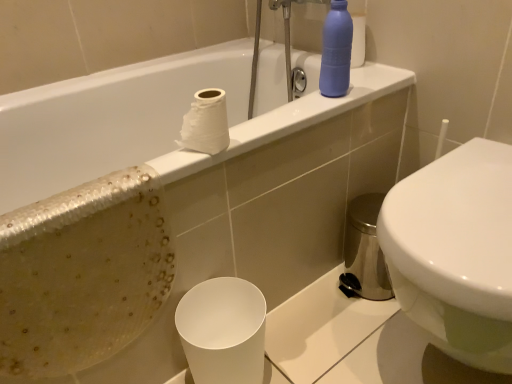
Locate an element on the screen. white glossy bathtub at upper center is located at coordinates (212, 172).

Identify the location of matte blue bottle at upper right. This screenshot has width=512, height=384. (336, 51).

What do you see at coordinates (206, 123) in the screenshot? Image resolution: width=512 pixels, height=384 pixels. I see `white matte toilet paper at upper center` at bounding box center [206, 123].

At what (x,y) coordinates should I click in order to perform the action: click on white glossy bathtub at upper center. Please return your answer as a coordinate pair (x, y). The height and width of the screenshot is (384, 512). Looking at the image, I should click on (212, 172).

Considering the relative positions of white matte paper cup at lower center and matte blue bottle at upper right in the image provided, is white matte paper cup at lower center to the left of matte blue bottle at upper right from the viewer's perspective?

Indeed, white matte paper cup at lower center is positioned on the left side of matte blue bottle at upper right.

This screenshot has width=512, height=384. I want to click on paper cup located underneath the matte blue bottle at upper right (from a real-world perspective), so click(223, 331).

Would you say white matte paper cup at lower center is inside or outside matte blue bottle at upper right?

white matte paper cup at lower center is outside matte blue bottle at upper right.

Considering the sizes of objects white matte paper cup at lower center and matte blue bottle at upper right in the image provided, who is wider, white matte paper cup at lower center or matte blue bottle at upper right?

white matte paper cup at lower center is wider.

Considering the sizes of objects white matte paper cup at lower center and white matte toilet paper at upper center in the image provided, who is wider, white matte paper cup at lower center or white matte toilet paper at upper center?

Wider between the two is white matte paper cup at lower center.

Is white matte paper cup at lower center positioned with its back to white matte toilet paper at upper center?

white matte paper cup at lower center is not turned away from white matte toilet paper at upper center.

Which is more to the right, white matte paper cup at lower center or white matte toilet paper at upper center?

From the viewer's perspective, white matte paper cup at lower center appears more on the right side.

Does white glossy bathtub at upper center have a lesser width compared to matte blue bottle at upper right?

No, white glossy bathtub at upper center is not thinner than matte blue bottle at upper right.

From the image's perspective, is white glossy bathtub at upper center on matte blue bottle at upper right?

No, from the image's perspective, white glossy bathtub at upper center is not over matte blue bottle at upper right.

How much distance is there between white glossy bathtub at upper center and matte blue bottle at upper right?

white glossy bathtub at upper center and matte blue bottle at upper right are 15.93 inches apart from each other.

Which object is positioned more to the left, white glossy bathtub at upper center or matte blue bottle at upper right?

white glossy bathtub at upper center is more to the left.

Between white matte toilet paper at upper center and white glossy bathtub at upper center, which one appears on the right side from the viewer's perspective?

From the viewer's perspective, white matte toilet paper at upper center appears more on the right side.

From a real-world perspective, which object stands above the other?

In real-world perspective, white matte toilet paper at upper center is above.

Which of these two, white matte toilet paper at upper center or white glossy bathtub at upper center, is bigger?

Bigger between the two is white glossy bathtub at upper center.

From the picture: Is white glossy bathtub at upper center at the back of white matte toilet paper at upper center?

white matte toilet paper at upper center does not have its back to white glossy bathtub at upper center.

From the picture: Based on their sizes in the image, would you say white glossy bathtub at upper center is bigger or smaller than white matte toilet paper at upper center?

white glossy bathtub at upper center is bigger than white matte toilet paper at upper center.

Is white glossy bathtub at upper center facing towards white matte toilet paper at upper center?

No, white glossy bathtub at upper center is not oriented towards white matte toilet paper at upper center.

Which is more to the right, white glossy bathtub at upper center or white matte toilet paper at upper center?

Positioned to the right is white matte toilet paper at upper center.

Does matte blue bottle at upper right turn towards white glossy toilet at right?

No, matte blue bottle at upper right is not facing towards white glossy toilet at right.

Image resolution: width=512 pixels, height=384 pixels. Identify the location of toilet on the right of matte blue bottle at upper right. (456, 252).

Is matte blue bottle at upper right taller or shorter than white glossy toilet at right?

In the image, matte blue bottle at upper right appears to be shorter than white glossy toilet at right.

Considering the positions of point (208, 124) and point (392, 213), is point (208, 124) closer or farther from the camera than point (392, 213)?

Point (208, 124).

Does white matte toilet paper at upper center appear on the right side of white glossy toilet at right?

Incorrect, white matte toilet paper at upper center is not on the right side of white glossy toilet at right.

Is white matte toilet paper at upper center thinner than white glossy toilet at right?

Yes, white matte toilet paper at upper center is thinner than white glossy toilet at right.

Image resolution: width=512 pixels, height=384 pixels. In order to click on cleaning product behind the white matte paper cup at lower center in this screenshot , I will do `click(336, 51)`.

Image resolution: width=512 pixels, height=384 pixels. Find the location of `toilet paper in front of the white matte paper cup at lower center`. toilet paper in front of the white matte paper cup at lower center is located at coordinates (206, 123).

Considering their positions, is white matte toilet paper at upper center positioned closer to white matte paper cup at lower center than matte blue bottle at upper right?

white matte toilet paper at upper center lies closer to white matte paper cup at lower center than the other object.

Estimate the real-world distances between objects in this image. Which object is further from white glossy toilet at right, matte blue bottle at upper right or white matte paper cup at lower center?

Based on the image, matte blue bottle at upper right appears to be further to white glossy toilet at right.

When comparing their distances from white glossy toilet at right, does matte blue bottle at upper right or white matte toilet paper at upper center seem closer?

matte blue bottle at upper right is closer to white glossy toilet at right.

Looking at the image, which one is located further to white glossy toilet at right, white matte paper cup at lower center or white glossy bathtub at upper center?

white glossy bathtub at upper center lies further to white glossy toilet at right than the other object.

Based on the photo, looking at the image, which one is located further to matte blue bottle at upper right, white matte paper cup at lower center or white glossy bathtub at upper center?

white matte paper cup at lower center is further to matte blue bottle at upper right.

Looking at the image, which one is located further to white matte paper cup at lower center, white glossy toilet at right or matte blue bottle at upper right?

Among the two, matte blue bottle at upper right is located further to white matte paper cup at lower center.

Looking at the image, which one is located closer to white matte paper cup at lower center, matte blue bottle at upper right or white matte toilet paper at upper center?

white matte toilet paper at upper center is positioned closer to the anchor white matte paper cup at lower center.

Estimate the real-world distances between objects in this image. Which object is further from white glossy toilet at right, white matte paper cup at lower center or matte blue bottle at upper right?

matte blue bottle at upper right lies further to white glossy toilet at right than the other object.

Locate an element on the screen. Image resolution: width=512 pixels, height=384 pixels. bathtub between white matte toilet paper at upper center and white matte paper cup at lower center from top to bottom is located at coordinates (212, 172).

At what (x,y) coordinates should I click in order to perform the action: click on cleaning product between white glossy bathtub at upper center and white glossy toilet at right. Please return your answer as a coordinate pair (x, y). The height and width of the screenshot is (384, 512). Looking at the image, I should click on (336, 51).

At what (x,y) coordinates should I click in order to perform the action: click on toilet paper between white glossy bathtub at upper center and white glossy toilet at right. Please return your answer as a coordinate pair (x, y). Image resolution: width=512 pixels, height=384 pixels. Looking at the image, I should click on (206, 123).

Locate an element on the screen. paper cup between white glossy bathtub at upper center and white glossy toilet at right in the horizontal direction is located at coordinates (223, 331).